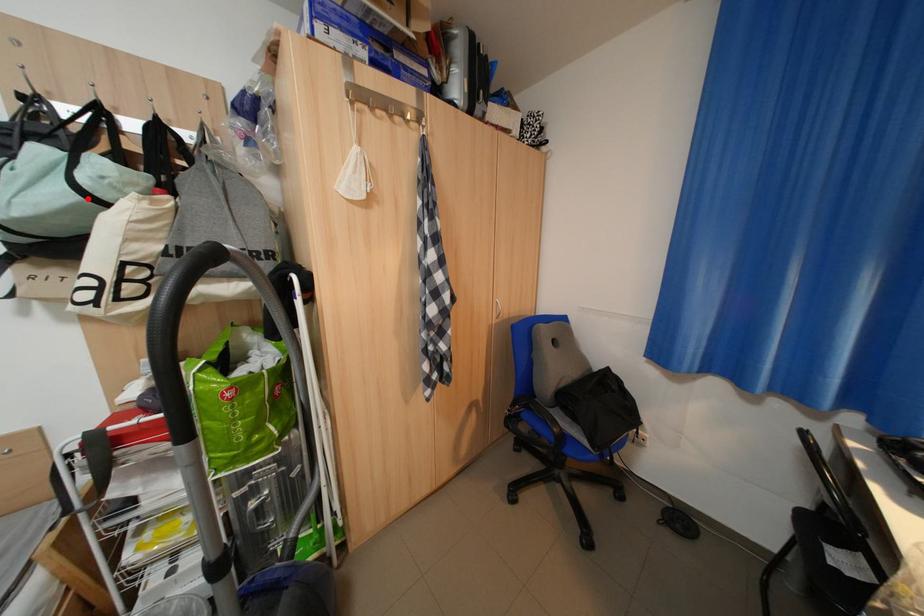
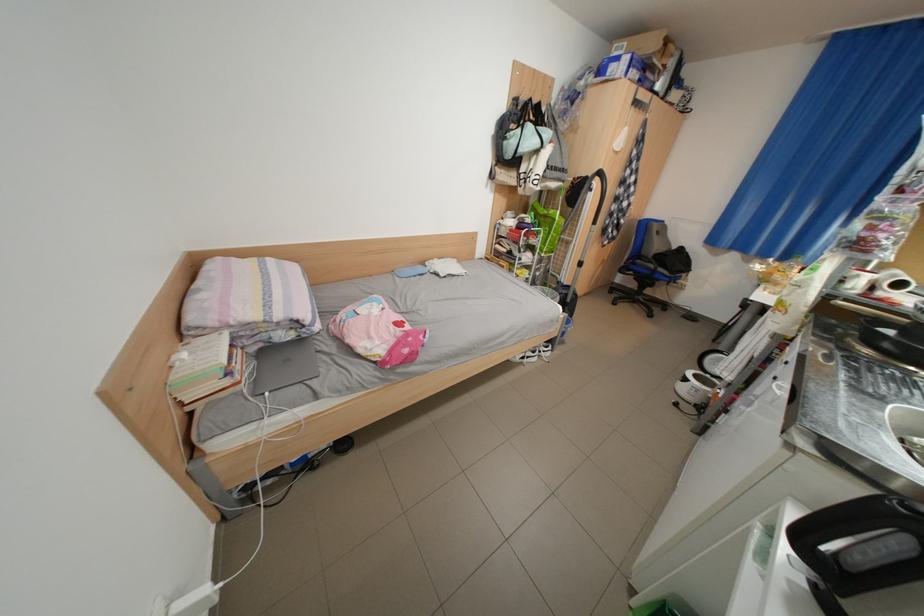
Question: I am providing you with two images of the same scene from different viewpoints. Given a red point in image1, look at the same physical point in image2. Is it:

Choices:
 (A) Closer to the viewpoint
 (B) Farther from the viewpoint

Answer: (A)